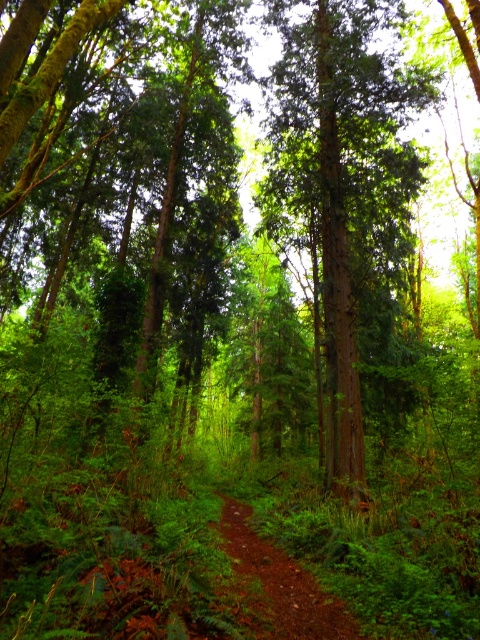
Question: Does green rough bark tree at center lie in front of damp dirt trail at center?

Choices:
 (A) no
 (B) yes

Answer: (A)

Question: Which point is farther from the camera taking this photo?

Choices:
 (A) (290, 80)
 (B) (343, 630)

Answer: (A)

Question: Can you confirm if green rough bark tree at center is bigger than damp dirt trail at center?

Choices:
 (A) no
 (B) yes

Answer: (B)

Question: Is green rough bark tree at center below damp dirt trail at center?

Choices:
 (A) yes
 (B) no

Answer: (B)

Question: Which point is farther to the camera?

Choices:
 (A) (276, 609)
 (B) (348, 113)

Answer: (B)